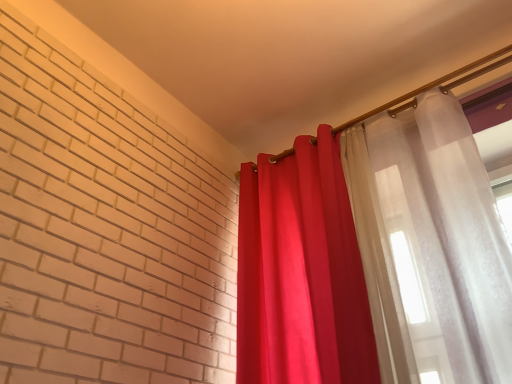
What is the approximate width of matte red curtain at right, the 2th curtain viewed from the right?

matte red curtain at right, the 2th curtain viewed from the right, is 12.48 inches in width.

The height and width of the screenshot is (384, 512). Describe the element at coordinates (301, 272) in the screenshot. I see `matte red curtain at right, the 2th curtain viewed from the right` at that location.

Measure the distance between matte red curtain at right, the 2th curtain viewed from the right, and camera.

matte red curtain at right, the 2th curtain viewed from the right, is 1.56 meters from camera.

Find the location of a particular element. matte red curtain at right, the 2th curtain viewed from the right is located at coordinates (301, 272).

This screenshot has width=512, height=384. Describe the element at coordinates (371, 254) in the screenshot. I see `translucent white curtain at upper right, which is counted as the second curtain, starting from the left` at that location.

This screenshot has width=512, height=384. Identify the location of translucent white curtain at upper right, which is the 1th curtain in right-to-left order. (371, 254).

Where is `matte red curtain at right, the 2th curtain viewed from the right`? The height and width of the screenshot is (384, 512). matte red curtain at right, the 2th curtain viewed from the right is located at coordinates (301, 272).

Can you confirm if translucent white curtain at upper right, which is counted as the second curtain, starting from the left, is positioned to the right of matte red curtain at right, the 2th curtain viewed from the right?

Yes, translucent white curtain at upper right, which is counted as the second curtain, starting from the left, is to the right of matte red curtain at right, the 2th curtain viewed from the right.

Is the position of translucent white curtain at upper right, which is counted as the second curtain, starting from the left, more distant than that of matte red curtain at right, the 2th curtain viewed from the right?

No, the depth of translucent white curtain at upper right, which is counted as the second curtain, starting from the left, is less than that of matte red curtain at right, the 2th curtain viewed from the right.

Which is nearer, (408, 126) or (279, 249)?

Point (408, 126).

Looking at this image, from the image's perspective, which is above, translucent white curtain at upper right, which is the 1th curtain in right-to-left order, or matte red curtain at right, acting as the first curtain starting from the left?

translucent white curtain at upper right, which is the 1th curtain in right-to-left order, is shown above in the image.

From a real-world perspective, is translucent white curtain at upper right, which is counted as the second curtain, starting from the left, over matte red curtain at right, the 2th curtain viewed from the right?

No, from a real-world perspective, translucent white curtain at upper right, which is counted as the second curtain, starting from the left, is not on top of matte red curtain at right, the 2th curtain viewed from the right.

Considering the relative sizes of translucent white curtain at upper right, which is counted as the second curtain, starting from the left, and matte red curtain at right, acting as the first curtain starting from the left, in the image provided, is translucent white curtain at upper right, which is counted as the second curtain, starting from the left, thinner than matte red curtain at right, acting as the first curtain starting from the left,?

Correct, the width of translucent white curtain at upper right, which is counted as the second curtain, starting from the left, is less than that of matte red curtain at right, acting as the first curtain starting from the left.

Between translucent white curtain at upper right, which is counted as the second curtain, starting from the left, and matte red curtain at right, the 2th curtain viewed from the right, which one has less height?

matte red curtain at right, the 2th curtain viewed from the right, is shorter.

Is translucent white curtain at upper right, which is counted as the second curtain, starting from the left, bigger than matte red curtain at right, the 2th curtain viewed from the right?

No.

Would you say translucent white curtain at upper right, which is the 1th curtain in right-to-left order, is inside or outside matte red curtain at right, the 2th curtain viewed from the right?

The correct answer is: outside.

From the picture: Is translucent white curtain at upper right, which is the 1th curtain in right-to-left order, far away from matte red curtain at right, the 2th curtain viewed from the right?

That's not correct — translucent white curtain at upper right, which is the 1th curtain in right-to-left order, is a little close to matte red curtain at right, the 2th curtain viewed from the right.

Is translucent white curtain at upper right, which is the 1th curtain in right-to-left order, looking in the opposite direction of matte red curtain at right, the 2th curtain viewed from the right?

No, translucent white curtain at upper right, which is the 1th curtain in right-to-left order, is not facing the opposite direction of matte red curtain at right, the 2th curtain viewed from the right.

How different are the orientations of translucent white curtain at upper right, which is the 1th curtain in right-to-left order, and matte red curtain at right, acting as the first curtain starting from the left, in degrees?

The facing directions of translucent white curtain at upper right, which is the 1th curtain in right-to-left order, and matte red curtain at right, acting as the first curtain starting from the left, are 2.31 degrees apart.

Identify the location of curtain that appears on the left of translucent white curtain at upper right, which is counted as the second curtain, starting from the left. (301, 272).

Is matte red curtain at right, acting as the first curtain starting from the left, to the left or to the right of translucent white curtain at upper right, which is the 1th curtain in right-to-left order, in the image?

matte red curtain at right, acting as the first curtain starting from the left, is positioned on translucent white curtain at upper right, which is the 1th curtain in right-to-left order,'s left side.

Which object is more forward, matte red curtain at right, the 2th curtain viewed from the right, or translucent white curtain at upper right, which is counted as the second curtain, starting from the left?

translucent white curtain at upper right, which is counted as the second curtain, starting from the left, is in front.

Does point (355, 366) lie behind point (418, 236)?

No, it is in front of (418, 236).

From the image's perspective, is matte red curtain at right, acting as the first curtain starting from the left, under translucent white curtain at upper right, which is the 1th curtain in right-to-left order?

Yes, from the image's perspective, matte red curtain at right, acting as the first curtain starting from the left, is below translucent white curtain at upper right, which is the 1th curtain in right-to-left order.

From a real-world perspective, which is physically above, matte red curtain at right, the 2th curtain viewed from the right, or translucent white curtain at upper right, which is the 1th curtain in right-to-left order?

In real-world perspective, matte red curtain at right, the 2th curtain viewed from the right, is above.

Is matte red curtain at right, the 2th curtain viewed from the right, wider or thinner than translucent white curtain at upper right, which is the 1th curtain in right-to-left order?

In the image, matte red curtain at right, the 2th curtain viewed from the right, appears to be wider than translucent white curtain at upper right, which is the 1th curtain in right-to-left order.

Which of these two, matte red curtain at right, acting as the first curtain starting from the left, or translucent white curtain at upper right, which is counted as the second curtain, starting from the left, stands taller?

translucent white curtain at upper right, which is counted as the second curtain, starting from the left, is taller.

Is matte red curtain at right, acting as the first curtain starting from the left, smaller than translucent white curtain at upper right, which is the 1th curtain in right-to-left order?

No, matte red curtain at right, acting as the first curtain starting from the left, is not smaller than translucent white curtain at upper right, which is the 1th curtain in right-to-left order.

Would you say matte red curtain at right, acting as the first curtain starting from the left, is inside or outside translucent white curtain at upper right, which is the 1th curtain in right-to-left order?

matte red curtain at right, acting as the first curtain starting from the left, is not enclosed by translucent white curtain at upper right, which is the 1th curtain in right-to-left order.

Is matte red curtain at right, acting as the first curtain starting from the left, in contact with translucent white curtain at upper right, which is the 1th curtain in right-to-left order?

Yes, matte red curtain at right, acting as the first curtain starting from the left, is next to translucent white curtain at upper right, which is the 1th curtain in right-to-left order.

Consider the image. Is matte red curtain at right, acting as the first curtain starting from the left, oriented away from translucent white curtain at upper right, which is counted as the second curtain, starting from the left?

No.

Looking at this image, how different are the orientations of matte red curtain at right, acting as the first curtain starting from the left, and translucent white curtain at upper right, which is the 1th curtain in right-to-left order, in degrees?

The angular difference between matte red curtain at right, acting as the first curtain starting from the left, and translucent white curtain at upper right, which is the 1th curtain in right-to-left order, is 2.31 degrees.

Where is `curtain located above the translucent white curtain at upper right, which is the 1th curtain in right-to-left order (from a real-world perspective)`? This screenshot has width=512, height=384. curtain located above the translucent white curtain at upper right, which is the 1th curtain in right-to-left order (from a real-world perspective) is located at coordinates (301, 272).

The image size is (512, 384). In order to click on curtain below the matte red curtain at right, the 2th curtain viewed from the right (from a real-world perspective) in this screenshot , I will do `click(371, 254)`.

Identify the location of curtain behind the translucent white curtain at upper right, which is the 1th curtain in right-to-left order. The image size is (512, 384). [x=301, y=272].